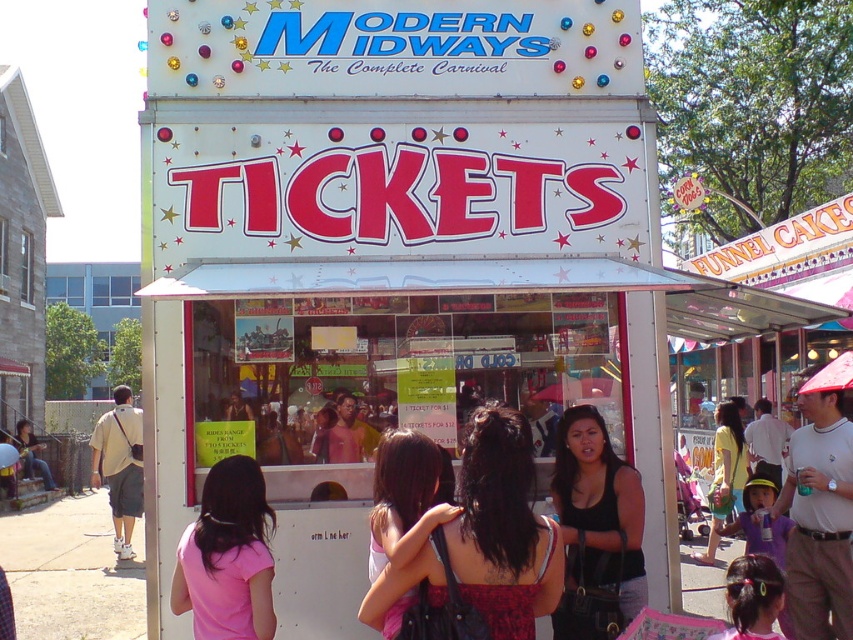
Which is below, matte black hair at center or pink fabric hair at center?

pink fabric hair at center

In the scene shown: Is matte black hair at center thinner than pink fabric hair at center?

Incorrect, matte black hair at center's width is not less than pink fabric hair at center's.

Does point (525, 545) come farther from viewer compared to point (738, 561)?

That is False.

Image resolution: width=853 pixels, height=640 pixels. In order to click on matte black hair at center in this screenshot , I will do `click(503, 529)`.

Can you confirm if matte pink shirt at center is taller than yellow-green jersey at center?

In fact, matte pink shirt at center may be shorter than yellow-green jersey at center.

Who is positioned more to the right, matte pink shirt at center or yellow-green jersey at center?

yellow-green jersey at center is more to the right.

Who is more distant from viewer, (380,452) or (728,513)?

The point (728,513) is behind.

Where is `matte pink shirt at center`? This screenshot has width=853, height=640. matte pink shirt at center is located at coordinates (407, 497).

Which is behind, point (637, 605) or point (834, 580)?

Point (834, 580)

Between black matte tank top at center and white plastic umbrella at upper right, which one is positioned lower?

white plastic umbrella at upper right is below.

Does point (614, 580) come farther from viewer compared to point (850, 472)?

No.

Find the location of `black matte tank top at center`. black matte tank top at center is located at coordinates (596, 529).